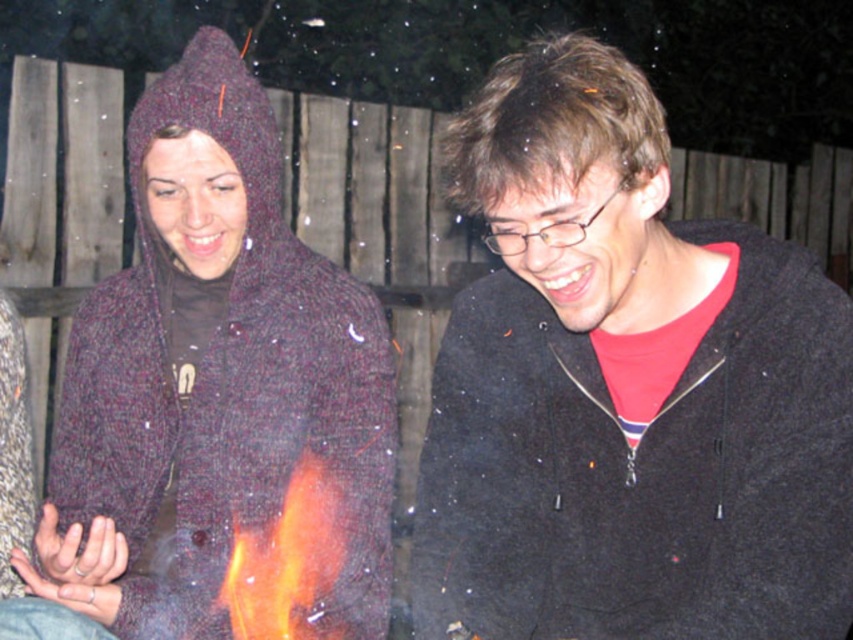
You are a fashion designer who needs to create a new line of winter clothing. You observe the black matte jacket at center and the knitted woolen sweater at left in the image. Which garment has a wider silhouette?

The knitted woolen sweater at left has a wider silhouette than the black matte jacket at center, as the black matte jacket at center is narrower in width.

You are standing at the point labeled point (195, 358) and want to take a photo of the two people around the fire. You have a camera with a maximum focus range of 1.5 meters. Will the camera be able to focus on the people?

The point labeled point (195, 358) and the camera are 1.66 meters apart. Since the camera can only focus up to 1.5 meters, it will not be able to focus on the people at that distance.